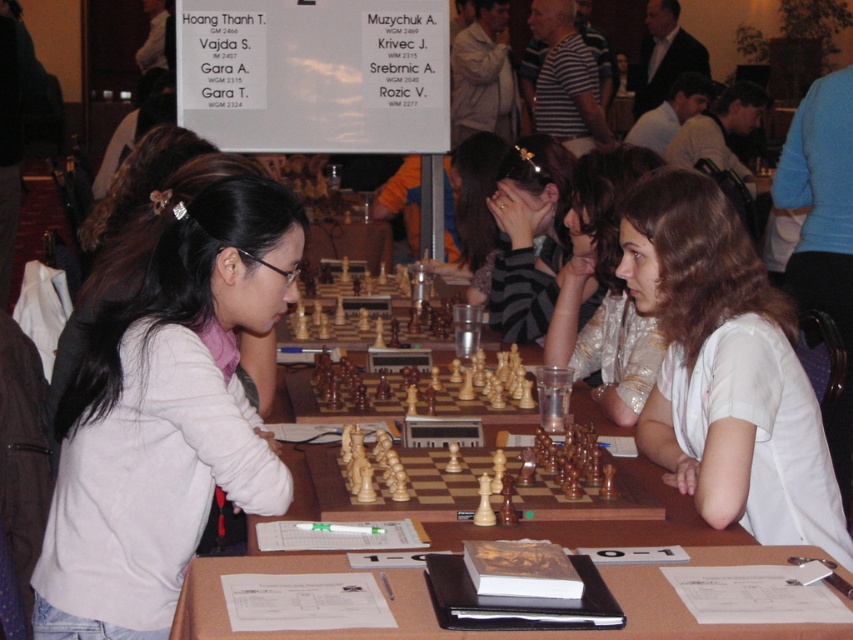
You are a photographer taking a picture of the chess tournament. You need to focus on both the point at coordinates point (x=560, y=240) and point (x=428, y=360). Which point should you focus on first to ensure both are in focus?

You should focus on point (x=560, y=240) first because it is further away from the camera compared to point (x=428, y=360). By focusing on the further point, the closer point will also be within the depth of field.

In the scene shown: You are a photographer wanting to capture a closeup of the white matte shirt at left and the black leather shoes at right. The camera you have can only focus on objects within a 1.5 meter range. Can you take a photo of both objects at the same time?

The white matte shirt at left and the black leather shoes at right are 1.52 meters apart. Since the camera can only focus within 1.5 meters, the distance between them exceeds the camera range. Therefore, you cannot take a photo of both objects simultaneously.

You are a photographer at the chess tournament and want to capture a photo of the white matte shirt at left and the wooden table at center. From the viewer perspective, which object is located to the left of the other?

The white matte shirt at left is positioned on the left side of the wooden table at center.